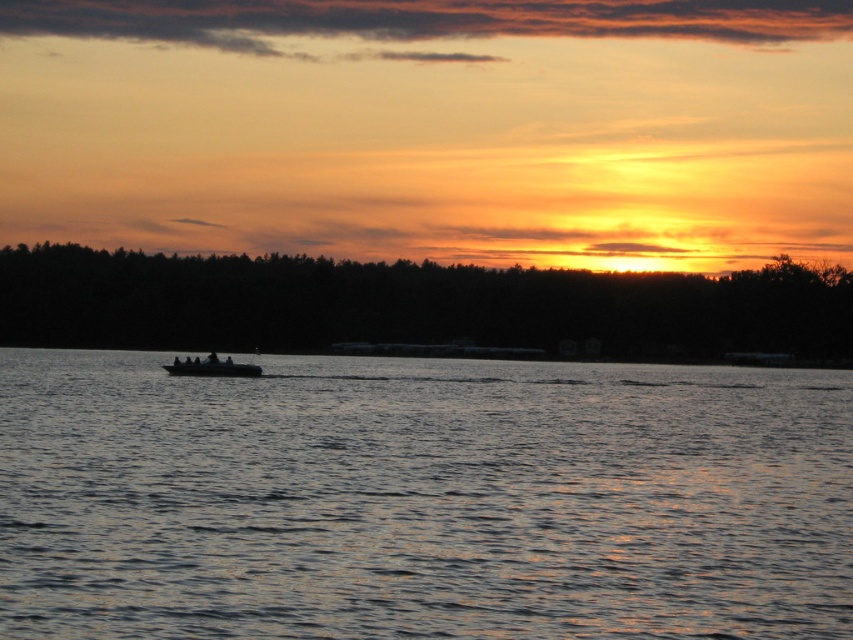
How far apart are dark blue water at center and dark gray metallic boat at center?

dark blue water at center is 16.31 meters away from dark gray metallic boat at center.

Looking at this image, can you confirm if dark blue water at center is shorter than dark gray metallic boat at center?

In fact, dark blue water at center may be taller than dark gray metallic boat at center.

What are the coordinates of `dark blue water at center` in the screenshot? It's located at (421, 499).